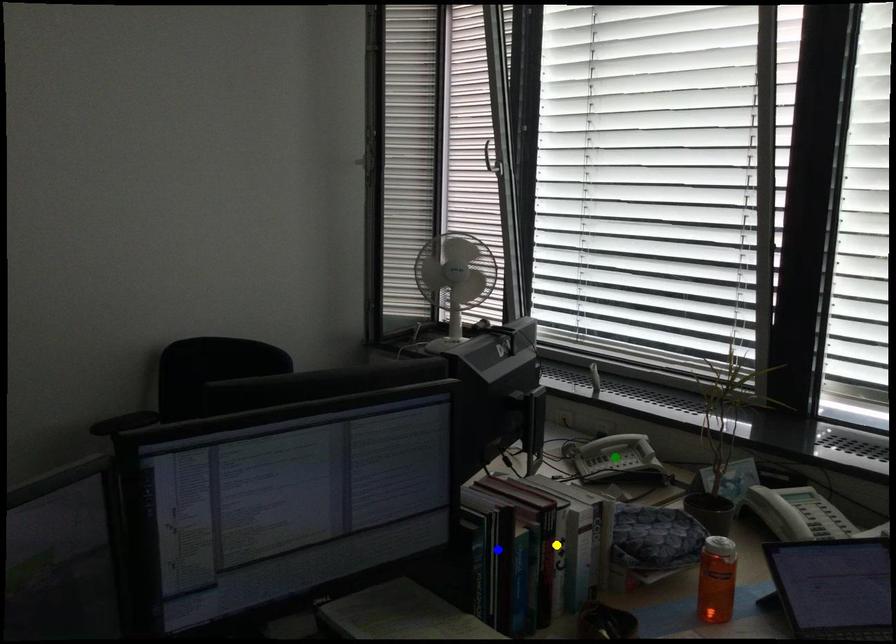
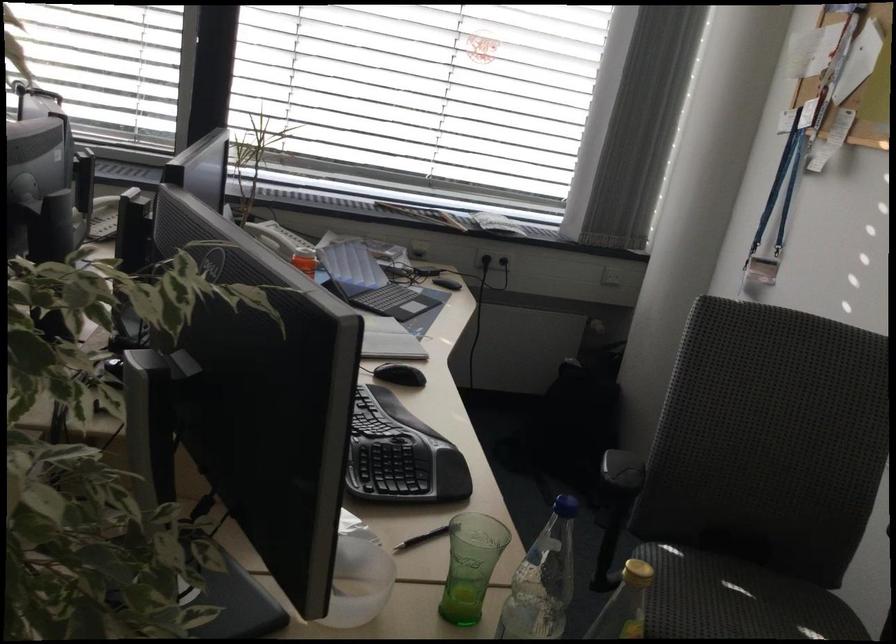
I am providing you with two images of the same scene from different viewpoints. Three points are marked in image1. Which point corresponds to a part or object that is occluded in image2?In image1, three points are marked. Which of them correspond to a part or object that is occluded in image2?Among the three points shown in image1, which one corresponds to a part or object that is no longer visible due to occlusion in image2?

Invisible in image2: blue point, green point, yellow point.